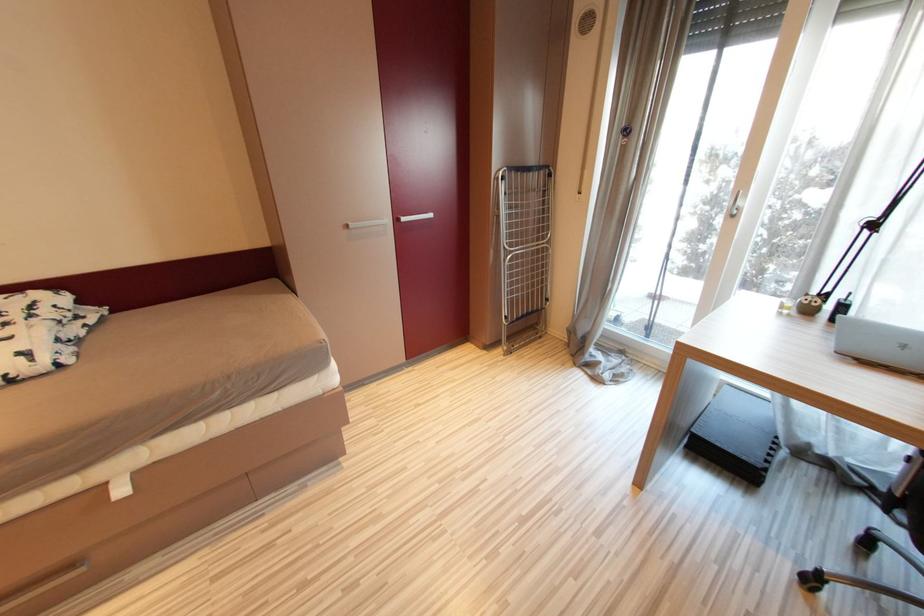
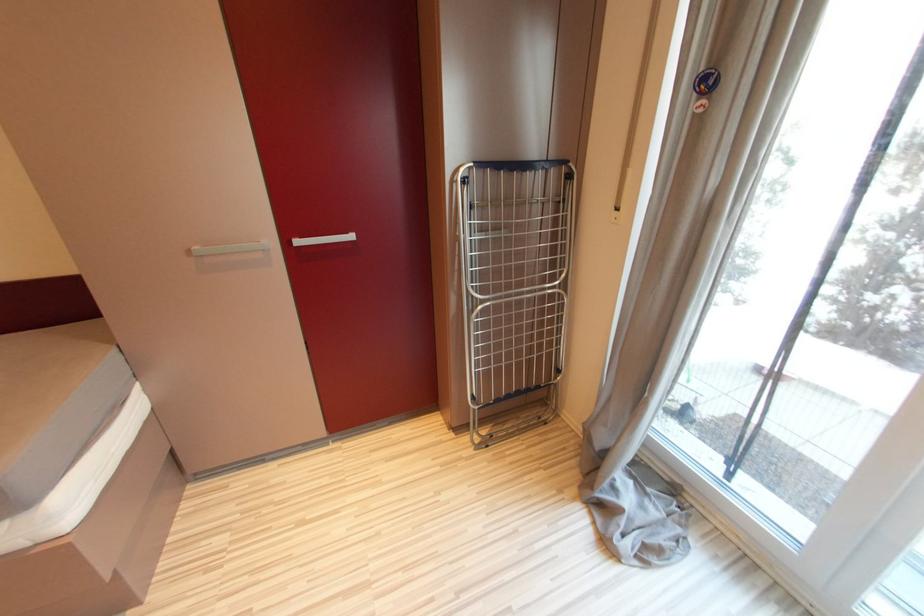
In a continuous first-person perspective shot, in which direction is the camera moving?

The cameraman moved toward right, forward.